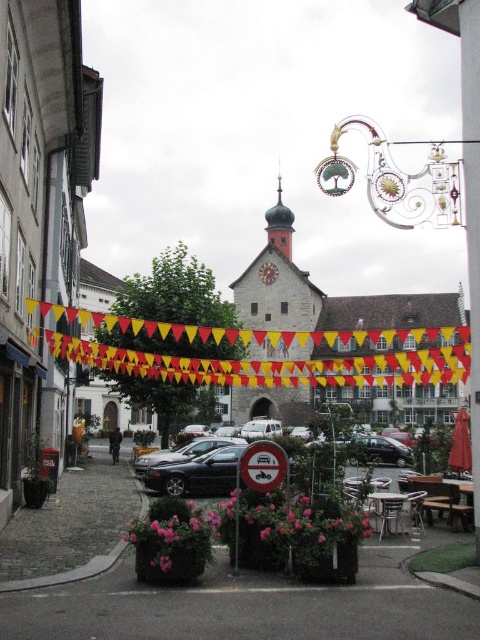
You are standing on the cobblestone street and see two points marked on the ground. The first point is at coordinates point [240,449] and the second is at point [240,461]. Which point is closer to you?

Point [240,461] is closer to you because it is in front of point [240,449].

You are a tourist standing at the center of the cobblestone street in the European town. You notice two points marked on the ground ahead of you. The first is at coordinates point [210,484] and the second is at point [260,465]. If you were to walk towards both points, which one would you reach first?

Point [260,465] would be reached first because it is closer to you than point [210,484], which is further away.

You are a tourist driving a car and want to read the red plastic sign at center. Can you see it from your current position in the shiny black sedan at center?

The red plastic sign at center is behind the shiny black sedan at center, so you cannot see it from your current position in the shiny black sedan at center.